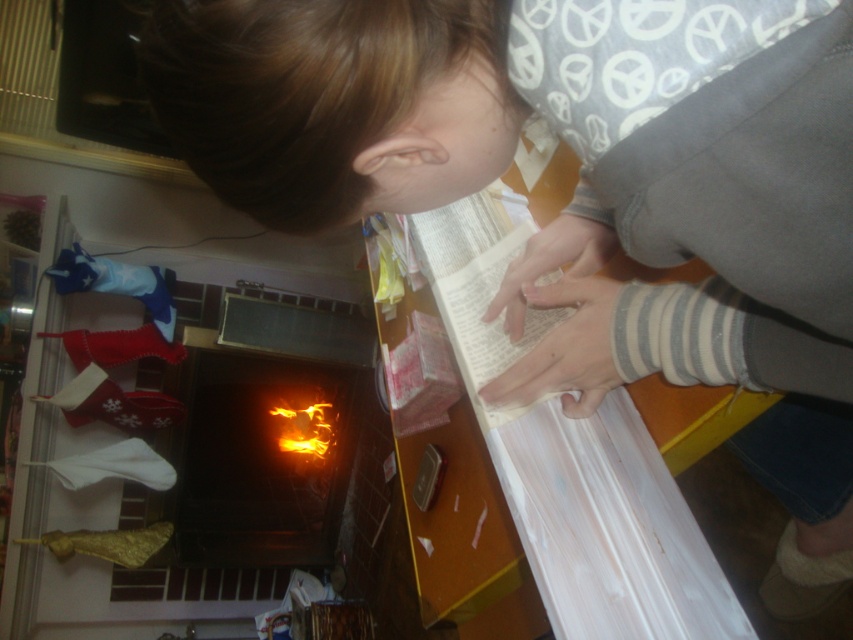
You are a visitor at a dollhouse exhibition and notice the brick fireplace at lower left and the orange glowing fire at center. Which object takes up more space in the scene?

The brick fireplace at lower left has a larger size compared to the orange glowing fire at center, so it takes up more space in the scene.

You are a guest in a dollhouse and need to place a tiny candle on the brick fireplace at lower left. Where should you place it relative to the orange glowing fire at center?

The brick fireplace at lower left is to the left of the orange glowing fire at center, so you should place the candle on the brick fireplace at lower left, which is located to the left of the orange glowing fire at center.

From the picture: You are a visitor in a dollhouse exhibition and notice the brick fireplace at lower left and the orange glowing fire at center. Which object is taller?

The brick fireplace at lower left is taller than the orange glowing fire at center.